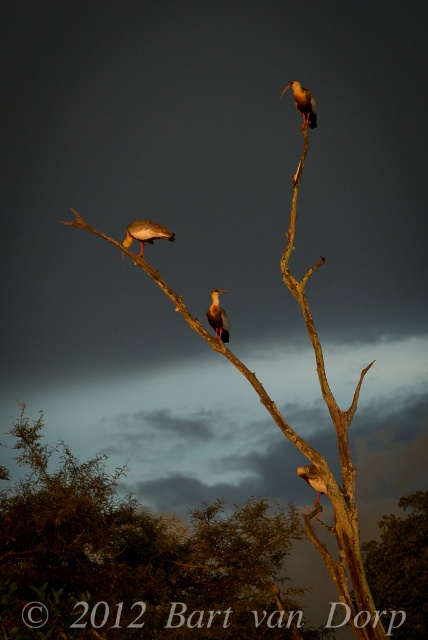
You are a birdwatcher observing the scene. You notice the brown wood tree at upper center and the white feathered bird at center. Which object occupies a larger vertical space in the image?

The brown wood tree at upper center is much taller than the white feathered bird at center, so it occupies a larger vertical space in the image.

Consider the image. You are a birdwatcher trying to determine the relative sizes of the birds and the tree in the image. Based on the scene, can you tell if the brown wood tree at upper center is wider than the white feathered bird at center?

The brown wood tree at upper center is wider than the white feathered bird at center according to the description.

You are standing 15 meters away from a tree with a brown feathered bird at upper center. Can you confirm if the bird is within your reach?

The brown feathered bird at upper center is 14.92 meters away from the camera, so yes, it is within your reach since it is just under 15 meters away.